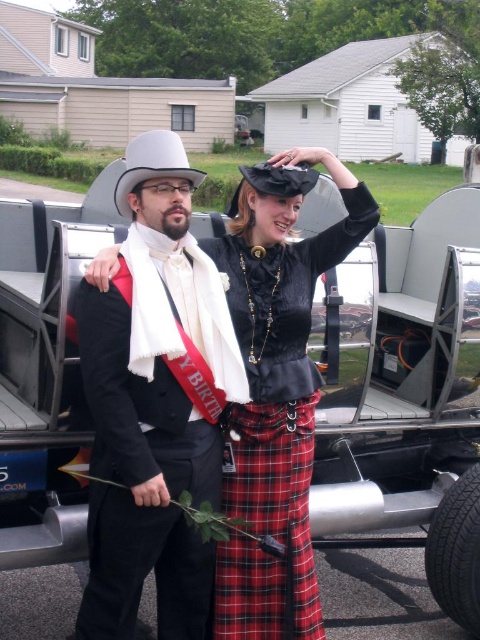
Question: Is matte black suit at center smaller than velvet black blouse at center?

Choices:
 (A) no
 (B) yes

Answer: (A)

Question: Observing the image, what is the correct spatial positioning of matte black suit at center in reference to velvet black blouse at center?

Choices:
 (A) above
 (B) below

Answer: (A)

Question: Which of the following is the closest to the observer?

Choices:
 (A) velvet black blouse at center
 (B) matte black suit at center

Answer: (B)

Question: Which point is farther from the camera taking this photo?

Choices:
 (A) (91, 280)
 (B) (261, 348)

Answer: (B)

Question: Which object is closer to the camera taking this photo?

Choices:
 (A) velvet black blouse at center
 (B) matte black suit at center

Answer: (B)

Question: Is matte black suit at center above velvet black blouse at center?

Choices:
 (A) yes
 (B) no

Answer: (A)